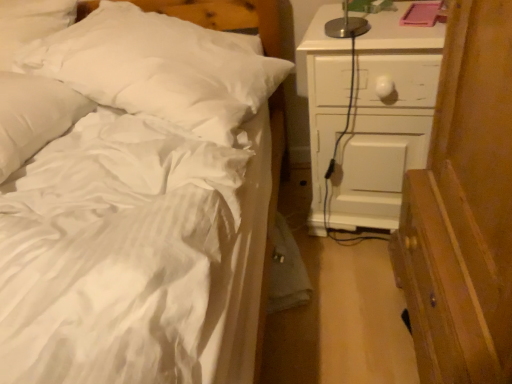
Question: Is white soft pillow at upper left, marked as the 1th pillow in a left-to-right arrangement, far from white painted wood chest of drawers at right?

Choices:
 (A) yes
 (B) no

Answer: (B)

Question: Can you confirm if white soft pillow at upper left, marked as the 1th pillow in a left-to-right arrangement, is positioned to the left of white painted wood chest of drawers at right?

Choices:
 (A) no
 (B) yes

Answer: (B)

Question: Is white soft pillow at upper left, marked as the 1th pillow in a left-to-right arrangement, facing towards white painted wood chest of drawers at right?

Choices:
 (A) yes
 (B) no

Answer: (B)

Question: Does white soft pillow at upper left, marked as the 1th pillow in a left-to-right arrangement, lie behind white painted wood chest of drawers at right?

Choices:
 (A) yes
 (B) no

Answer: (B)

Question: Is white soft pillow at upper left, which is counted as the second pillow, starting from the right, taller than white painted wood chest of drawers at right?

Choices:
 (A) yes
 (B) no

Answer: (B)

Question: From a real-world perspective, is white soft pillow at upper left, the first pillow viewed from the right, positioned above or below white soft pillow at upper left, marked as the 1th pillow in a left-to-right arrangement?

Choices:
 (A) below
 (B) above

Answer: (A)

Question: Is white soft pillow at upper left, acting as the second pillow starting from the left, situated inside white soft pillow at upper left, marked as the 1th pillow in a left-to-right arrangement, or outside?

Choices:
 (A) inside
 (B) outside

Answer: (B)

Question: From the image's perspective, relative to white soft pillow at upper left, which is counted as the second pillow, starting from the right, is white soft pillow at upper left, the first pillow viewed from the right, above or below?

Choices:
 (A) above
 (B) below

Answer: (A)

Question: Is white soft pillow at upper left, the first pillow viewed from the right, in front of or behind white soft pillow at upper left, marked as the 1th pillow in a left-to-right arrangement, in the image?

Choices:
 (A) behind
 (B) front

Answer: (A)

Question: From the image's perspective, relative to white soft pillow at upper left, marked as the 1th pillow in a left-to-right arrangement, is white painted wood chest of drawers at right above or below?

Choices:
 (A) above
 (B) below

Answer: (A)

Question: From a real-world perspective, is white painted wood chest of drawers at right physically located above or below white soft pillow at upper left, marked as the 1th pillow in a left-to-right arrangement?

Choices:
 (A) above
 (B) below

Answer: (B)

Question: Is white painted wood chest of drawers at right taller or shorter than white soft pillow at upper left, which is counted as the second pillow, starting from the right?

Choices:
 (A) short
 (B) tall

Answer: (B)

Question: Considering the positions of white painted wood chest of drawers at right and white soft pillow at upper left, marked as the 1th pillow in a left-to-right arrangement, in the image, is white painted wood chest of drawers at right wider or thinner than white soft pillow at upper left, marked as the 1th pillow in a left-to-right arrangement,?

Choices:
 (A) thin
 (B) wide

Answer: (B)

Question: Is white painted wood chest of drawers at right in front of or behind white soft pillow at upper left, the first pillow viewed from the right, in the image?

Choices:
 (A) front
 (B) behind

Answer: (B)

Question: Considering the positions of white painted wood chest of drawers at right and white soft pillow at upper left, the first pillow viewed from the right, in the image, is white painted wood chest of drawers at right wider or thinner than white soft pillow at upper left, the first pillow viewed from the right,?

Choices:
 (A) thin
 (B) wide

Answer: (A)